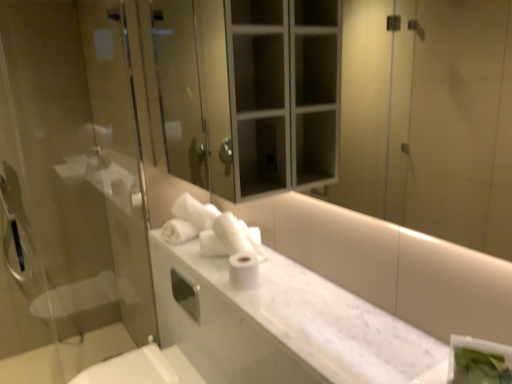
Question: From the image's perspective, does white marble counter top at center appear lower than transparent glass screen door at left?

Choices:
 (A) yes
 (B) no

Answer: (A)

Question: Is white marble counter top at center at the left side of transparent glass screen door at left?

Choices:
 (A) no
 (B) yes

Answer: (A)

Question: Does white marble counter top at center lie behind transparent glass screen door at left?

Choices:
 (A) no
 (B) yes

Answer: (A)

Question: Does white marble counter top at center have a lesser height compared to transparent glass screen door at left?

Choices:
 (A) no
 (B) yes

Answer: (B)

Question: From the image's perspective, is white marble counter top at center over transparent glass screen door at left?

Choices:
 (A) yes
 (B) no

Answer: (B)

Question: Could you tell me if white marble counter top at center is turned towards transparent glass screen door at left?

Choices:
 (A) no
 (B) yes

Answer: (A)

Question: From a real-world perspective, is white matte toilet paper at center over transparent glass screen door at left?

Choices:
 (A) yes
 (B) no

Answer: (B)

Question: Can you confirm if white matte toilet paper at center is smaller than transparent glass screen door at left?

Choices:
 (A) yes
 (B) no

Answer: (A)

Question: Does white matte toilet paper at center have a lesser height compared to transparent glass screen door at left?

Choices:
 (A) no
 (B) yes

Answer: (B)

Question: Is white matte toilet paper at center thinner than transparent glass screen door at left?

Choices:
 (A) yes
 (B) no

Answer: (B)

Question: From the image's perspective, is white matte toilet paper at center under transparent glass screen door at left?

Choices:
 (A) no
 (B) yes

Answer: (B)

Question: Is white matte toilet paper at center outside of transparent glass screen door at left?

Choices:
 (A) no
 (B) yes

Answer: (B)

Question: From the image's perspective, would you say white glossy mirror at upper center is positioned over white marble counter top at center?

Choices:
 (A) no
 (B) yes

Answer: (B)